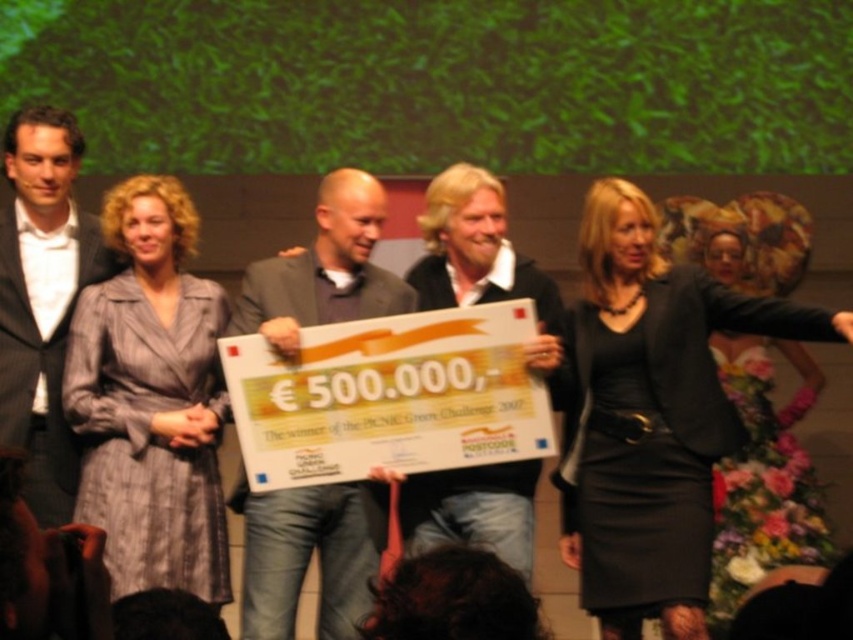
You are a photographer standing in front of the stage. You need to capture a photo of the gray striped dress at center and the matte black suit at left. Based on their sizes, which one might appear larger in the photo?

The gray striped dress at center might appear larger in the photo than the matte black suit at left because the gray striped dress at center might be wider than matte black suit at left.

You are a photographer at the BCNIC Green Challenge 2007 award ceremony. You need to capture a closeup shot of the check being held by the two individuals in the center. However, you notice that the matte gray suit at center and the matte black jacket at center might block the view. Which clothing item is closer to the camera, potentially obstructing the check?

The matte gray suit at center is above the matte black jacket at center, meaning it is closer to the camera and could be blocking the view of the check.